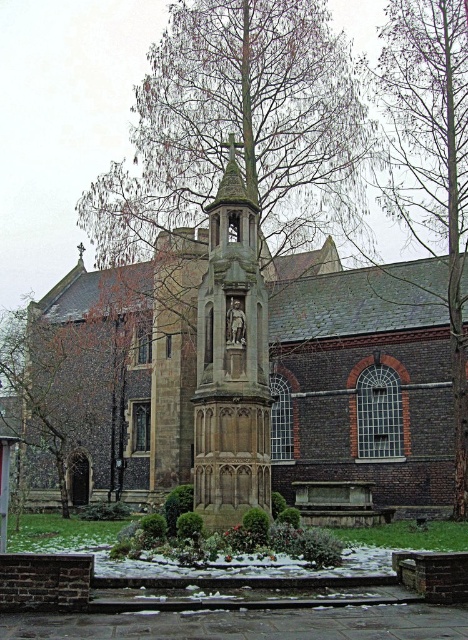
You are standing at the entrance of the courtyard. You want to take a photo of the brown stone church at center. Where should you position yourself to capture the monument in the center of your camera frame?

To capture the brown stone church at center in the center of your camera frame, position yourself directly in front of the monument at point (263, 362).

You are standing in the courtyard of the historic church. You see a bare wood tree at right and a stone statue at center. Which object is higher up in the scene?

The bare wood tree at right is positioned over the stone statue at center, so it is higher up in the scene.

You are standing in the courtyard of the brown stone church at center. You notice the stone statue at center. Which object is positioned higher up in the image?

The stone statue at center is positioned higher up than the brown stone church at center.